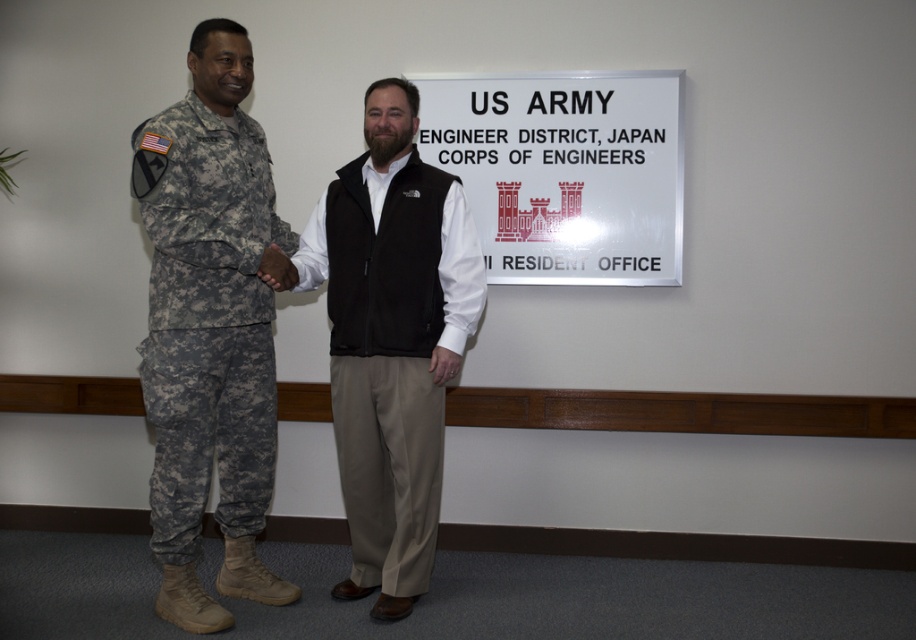
Between black fleece vest at center and camouflage fabric uniform at left, which one appears on the right side from the viewer's perspective?

Positioned to the right is black fleece vest at center.

Is point (427, 506) farther from viewer compared to point (151, 481)?

That is True.

Locate an element on the screen. The height and width of the screenshot is (640, 916). black fleece vest at center is located at coordinates (391, 340).